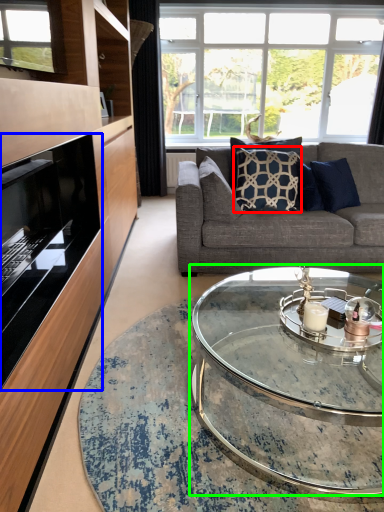
Question: Based on their relative distances, which object is farther from pillow (highlighted by a red box)? Choose from fireplace (highlighted by a blue box) and coffee table (highlighted by a green box).

Choices:
 (A) fireplace
 (B) coffee table

Answer: (A)